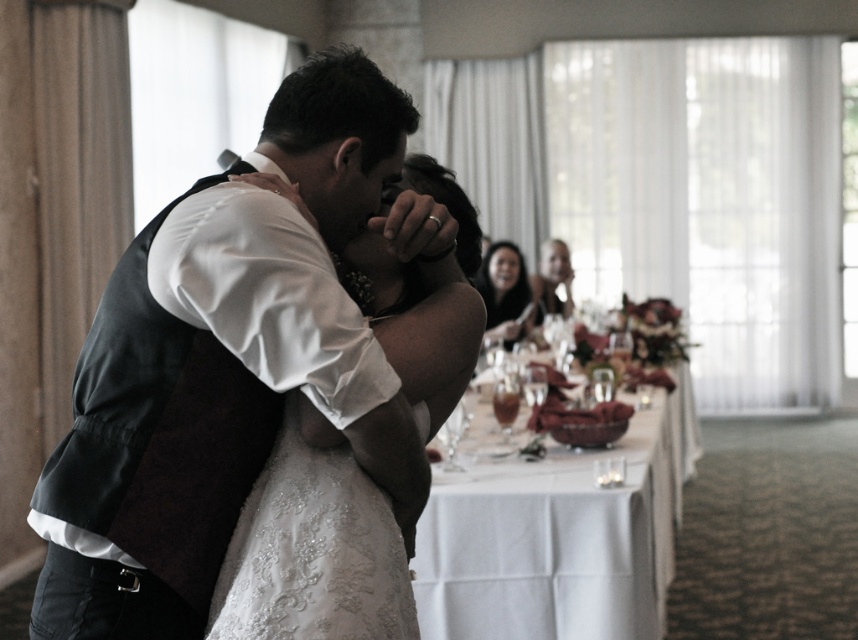
Is matte black vest at center bigger than smooth black hair at center?

Correct, matte black vest at center is larger in size than smooth black hair at center.

Which is more to the left, matte black vest at center or smooth black hair at center?

From the viewer's perspective, matte black vest at center appears more on the left side.

In order to click on matte black vest at center in this screenshot , I will do `click(228, 364)`.

This screenshot has width=858, height=640. I want to click on matte black vest at center, so click(x=228, y=364).

Is white cloth at center smaller than smooth black hair at center?

No, white cloth at center is not smaller than smooth black hair at center.

Measure the distance from white cloth at center to smooth black hair at center.

1.98 meters

Between point (677, 404) and point (482, 291), which one is positioned behind?

The point (482, 291) is behind.

You are a GUI agent. You are given a task and a screenshot of the screen. Output one action in this format:
    pyautogui.click(x=<x>, y=<y>)
    Task: Click on the white cloth at center
    The width and height of the screenshot is (858, 640).
    Given the screenshot: What is the action you would take?
    pyautogui.click(x=557, y=532)

How distant is matte black vest at center from white cloth at center?

A distance of 2.18 meters exists between matte black vest at center and white cloth at center.

Does matte black vest at center lie in front of white cloth at center?

Yes, matte black vest at center is closer to the viewer.

The height and width of the screenshot is (640, 858). What do you see at coordinates (228, 364) in the screenshot?
I see `matte black vest at center` at bounding box center [228, 364].

Where is `matte black vest at center`? matte black vest at center is located at coordinates (228, 364).